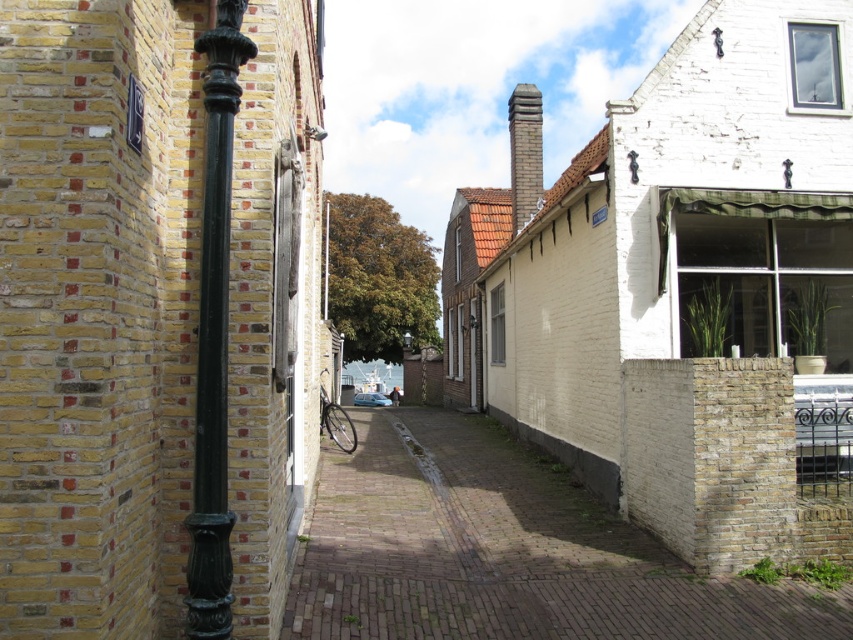
You are standing on the street and want to walk towards the point at coordinates point (209,225). However, there is an obstacle at point (799,625). Can you reach your destination without passing through the obstacle?

Point (799,625) is behind point (209,225), so you can reach the destination without passing through the obstacle.

Based on the photo, you are a delivery person carrying a heavy box and need to walk through the brick paved alley at center. There is a green patinated metal pole at left above you. Could the pole interfere with your head while walking through the alley?

The brick paved alley at center is positioned under the green patinated metal pole at left, meaning the pole is overhead. Since the pole is above the alley, it might interfere with your head depending on its height. However, without specific height details, we can only confirm the spatial relationship that the pole is above the alley.